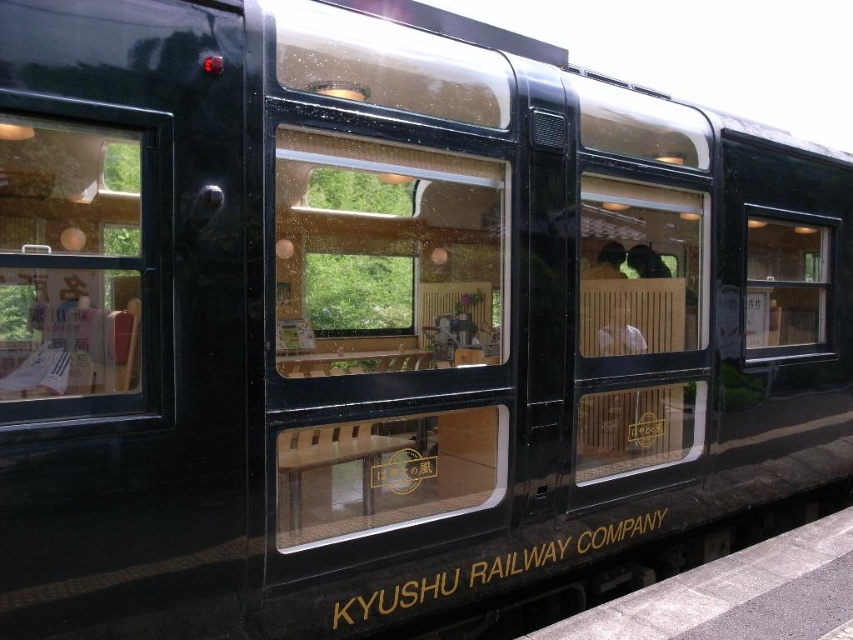
You are a passenger on the train and want to look outside. You notice two clear glass windows. Which window, the clear glass window at center or the clear glass window at right, allows you to see a wider view of the trees outside?

The clear glass window at center is taller than the clear glass window at right, so it allows you to see a wider view of the trees outside.

You are standing outside the train car and see the point at coordinates (386, 259). What object is located at that point?

The transparent glass train window at center is located at point 0.454, 0.406.

You are a passenger on the train and want to look outside. You see two windows, the transparent glass train window at center and the clear glass window at right. Which window should you choose if you want to see a wider view outside?

The transparent glass train window at center is wider than the clear glass window at right, so you should choose the transparent glass train window at center to see a wider view outside.